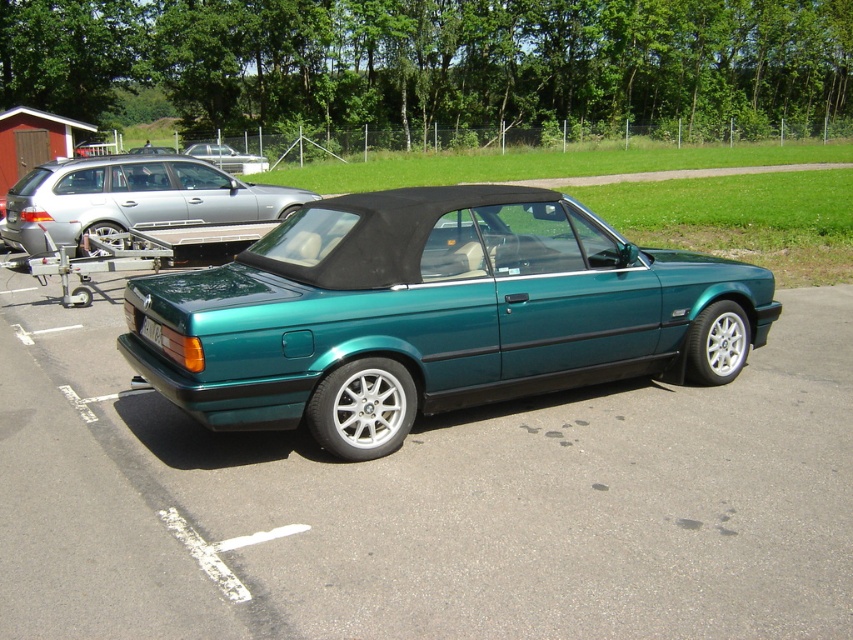
Does metallic teal car at center have a lesser height compared to satin silver metallic station wagon at upper left?

Correct, metallic teal car at center is not as tall as satin silver metallic station wagon at upper left.

Measure the distance from metallic teal car at center to satin silver metallic station wagon at upper left.

They are 10.97 meters apart.

The width and height of the screenshot is (853, 640). In order to click on metallic teal car at center in this screenshot , I will do `click(428, 500)`.

Does satin silver metallic station wagon at upper left have a smaller size compared to teal metallic car at center?

Yes, satin silver metallic station wagon at upper left is smaller than teal metallic car at center.

Image resolution: width=853 pixels, height=640 pixels. Identify the location of satin silver metallic station wagon at upper left. (132, 198).

Who is more forward, (254, 156) or (143, 321)?

Point (143, 321)

Is teal metallic car at center behind green matte license plate at lower center?

Yes.

Which is in front, point (221, 148) or point (148, 326)?

Point (148, 326) is in front.

Identify the location of teal metallic car at center. (227, 157).